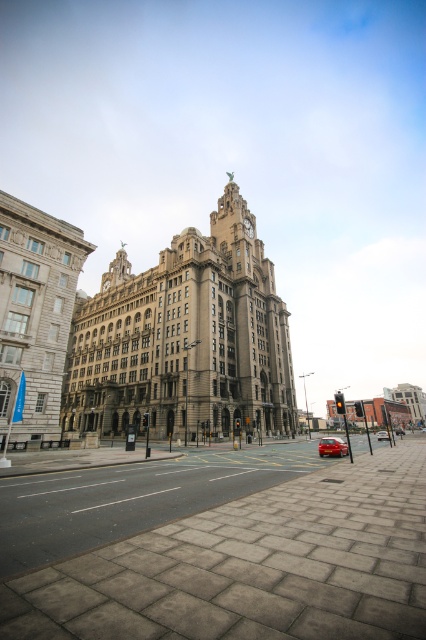
You are standing in front of the historic building with the clock tower and want to take a photo. You notice two points marked on the ground at coordinates point (377, 435) and point (397, 429). Which point should you stand closer to ensure your photo captures the building without any obstructions from the foreground elements?

You should stand closer to point (377, 435) because it is closer to the camera than point (397, 429), allowing for a clearer view of the building without foreground obstructions.

You are standing at the entrance of the grand historic building and want to cross the plaza to reach the traffic light on the right. Which direction should you walk relative to the shiny red car at center?

You should walk towards the right of the shiny red car at center because the traffic light is on the right side of the plaza, and the shiny red car at center is positioned at coordinates that place it centrally, so moving right from it would lead towards the traffic light.

You are a city planner analyzing the layout of the square. You notice two cars, a shiny red car at center and a metallic red car at center. Which car takes up more space in the image?

The shiny red car at center is bigger than the metallic red car at center, so it takes up more space in the image.